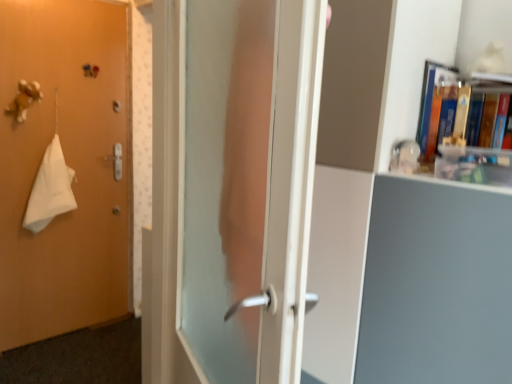
Locate an element on the screen. Image resolution: width=512 pixels, height=384 pixels. matte white bookcase at center is located at coordinates (399, 220).

Describe the element at coordinates (68, 165) in the screenshot. I see `matte orange door at left` at that location.

Identify the location of matte white bookcase at center. This screenshot has height=384, width=512. (399, 220).

Are matte white bookcase at center and hardcover book at upper right located far from each other?

Actually, matte white bookcase at center and hardcover book at upper right are a little close together.

Consider the image. Between matte white bookcase at center and hardcover book at upper right, which one has smaller width?

hardcover book at upper right.

From the image's perspective, between matte white bookcase at center and hardcover book at upper right, which one is located above?

hardcover book at upper right.

In terms of height, does white cloth at left look taller or shorter compared to transparent glass door at center?

In the image, white cloth at left appears to be shorter than transparent glass door at center.

Is point (64, 161) positioned behind point (211, 37)?

That is True.

Is transparent glass door at center surrounded by white cloth at left?

No.

How many degrees apart are the facing directions of matte orange door at left and matte white bookcase at center?

They differ by 88.8 degrees in their facing directions.

Is matte orange door at left oriented towards matte white bookcase at center?

Yes, matte orange door at left faces towards matte white bookcase at center.

Identify the location of bookcase positioned vertically above the matte orange door at left (from a real-world perspective). The height and width of the screenshot is (384, 512). (399, 220).

From a real-world perspective, is matte orange door at left on matte white bookcase at center?

Actually, matte orange door at left is physically below matte white bookcase at center in the real world.

Which object is wider, matte white bookcase at center or matte orange door at left?

matte white bookcase at center.

Can you confirm if matte white bookcase at center is taller than matte orange door at left?

In fact, matte white bookcase at center may be shorter than matte orange door at left.

From a real-world perspective, which is physically below, matte white bookcase at center or matte orange door at left?

From a 3D spatial view, matte orange door at left is below.

Is matte orange door at left surrounded by matte white bookcase at center?

No, matte orange door at left is not surrounded by matte white bookcase at center.

Can you tell me how much hardcover book at upper right and white cloth at left differ in facing direction?

They differ by 92 degrees in their facing directions.

Measure the distance from hardcover book at upper right to white cloth at left.

6.75 feet.

Could white cloth at left be considered to be inside hardcover book at upper right?

Actually, white cloth at left is outside hardcover book at upper right.

Which is more to the left, hardcover book at upper right or white cloth at left?

From the viewer's perspective, white cloth at left appears more on the left side.

From the image's perspective, is matte orange door at left positioned above or below transparent glass door at center?

Based on their image positions, matte orange door at left is located above transparent glass door at center.

Is matte orange door at left in front of or behind transparent glass door at center in the image?

matte orange door at left is positioned farther from the viewer than transparent glass door at center.

Considering the sizes of objects matte orange door at left and transparent glass door at center in the image provided, who is taller, matte orange door at left or transparent glass door at center?

matte orange door at left.

Is point (57, 212) closer to camera compared to point (413, 80)?

No, it is behind (413, 80).

Could you tell me if white cloth at left is turned towards matte white bookcase at center?

Yes, white cloth at left is aimed at matte white bookcase at center.

Between white cloth at left and matte white bookcase at center, which one has more height?

Standing taller between the two is matte white bookcase at center.

From the image's perspective, is white cloth at left located above or below matte white bookcase at center?

white cloth at left is above matte white bookcase at center.

Locate an element on the screen. This screenshot has width=512, height=384. book located on the right of matte white bookcase at center is located at coordinates (437, 107).

This screenshot has height=384, width=512. Identify the location of screen door located in front of the white cloth at left. (249, 182).

From the image, which object appears to be farther from hardcover book at upper right, matte white bookcase at center or matte orange door at left?

Among the two, matte orange door at left is located further to hardcover book at upper right.

From the image, which object appears to be farther from matte orange door at left, hardcover book at upper right or transparent glass door at center?

Among the two, hardcover book at upper right is located further to matte orange door at left.

Based on their spatial positions, is transparent glass door at center or hardcover book at upper right further from matte orange door at left?

hardcover book at upper right.

Which object lies further to the anchor point matte orange door at left, white cloth at left or transparent glass door at center?

transparent glass door at center is positioned further to the anchor matte orange door at left.

When comparing their distances from matte white bookcase at center, does hardcover book at upper right or transparent glass door at center seem closer?

hardcover book at upper right is positioned closer to the anchor matte white bookcase at center.

Which object lies nearer to the anchor point white cloth at left, matte white bookcase at center or hardcover book at upper right?

matte white bookcase at center lies closer to white cloth at left than the other object.

Considering their positions, is hardcover book at upper right positioned closer to white cloth at left than matte orange door at left?

Among the two, matte orange door at left is located nearer to white cloth at left.

Which object lies further to the anchor point white cloth at left, transparent glass door at center or matte orange door at left?

The object further to white cloth at left is transparent glass door at center.

The image size is (512, 384). Identify the location of door between transparent glass door at center and white cloth at left along the z-axis. (68, 165).

Find the location of a particular element. This screenshot has width=512, height=384. bookcase between white cloth at left and hardcover book at upper right is located at coordinates (399, 220).

This screenshot has height=384, width=512. I want to click on bookcase between transparent glass door at center and white cloth at left in the front-back direction, so click(399, 220).

I want to click on bookcase located between transparent glass door at center and hardcover book at upper right in the left-right direction, so click(x=399, y=220).